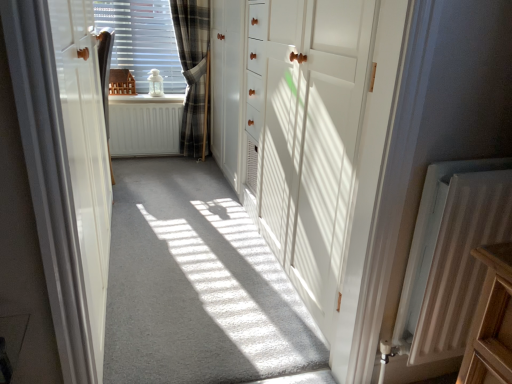
Question: Is white textured radiator at lower right, which appears as the first radiator when viewed from the front, completely or partially outside of plaid fabric curtain at center, which appears as the 1th curtain when viewed from the right?

Choices:
 (A) yes
 (B) no

Answer: (A)

Question: Is white textured radiator at lower right, the first radiator viewed from the right, beside plaid fabric curtain at center, which appears as the 2th curtain when viewed from the front?

Choices:
 (A) no
 (B) yes

Answer: (A)

Question: From a real-world perspective, is white textured radiator at lower right, placed as the second radiator when sorted from top to bottom, located higher than plaid fabric curtain at center, which is the 1th curtain in back-to-front order?

Choices:
 (A) yes
 (B) no

Answer: (B)

Question: Is white textured radiator at lower right, the 1th radiator positioned from the bottom, smaller than plaid fabric curtain at center, which appears as the 2th curtain when viewed from the front?

Choices:
 (A) no
 (B) yes

Answer: (B)

Question: Is white textured radiator at lower right, which is the 2th radiator in back-to-front order, positioned in front of plaid fabric curtain at center, which appears as the 2th curtain when viewed from the front?

Choices:
 (A) no
 (B) yes

Answer: (B)

Question: From a real-world perspective, is satin brown curtain at center, the second curtain in the back-to-front sequence, physically located above or below white carpet at center?

Choices:
 (A) above
 (B) below

Answer: (A)

Question: From the image's perspective, is satin brown curtain at center, positioned as the 1th curtain in left-to-right order, positioned above or below white carpet at center?

Choices:
 (A) above
 (B) below

Answer: (A)

Question: Considering the positions of satin brown curtain at center, acting as the 1th curtain starting from the front, and white carpet at center in the image, is satin brown curtain at center, acting as the 1th curtain starting from the front, bigger or smaller than white carpet at center?

Choices:
 (A) small
 (B) big

Answer: (A)

Question: Choose the correct answer: Is satin brown curtain at center, acting as the 1th curtain starting from the front, inside white carpet at center or outside it?

Choices:
 (A) outside
 (B) inside

Answer: (A)

Question: Considering the positions of point (56, 29) and point (440, 342), is point (56, 29) closer or farther from the camera than point (440, 342)?

Choices:
 (A) closer
 (B) farther

Answer: (B)

Question: Looking at their shapes, would you say white glossy door at left, the 1th door from the left, is wider or thinner than white textured radiator at lower right, which is the 2th radiator in back-to-front order?

Choices:
 (A) wide
 (B) thin

Answer: (A)

Question: From the image's perspective, relative to white textured radiator at lower right, the 2th radiator viewed from the left, is white glossy door at left, the 1th door from the left, above or below?

Choices:
 (A) below
 (B) above

Answer: (B)

Question: Is white glossy door at left, positioned as the second door in right-to-left order, situated inside white textured radiator at lower right, which appears as the first radiator when viewed from the front, or outside?

Choices:
 (A) inside
 (B) outside

Answer: (B)

Question: Is satin brown curtain at center, the second curtain when ordered from right to left, in front of or behind white wood door at center, the first door viewed from the right, in the image?

Choices:
 (A) front
 (B) behind

Answer: (B)

Question: From the image's perspective, relative to white wood door at center, the 2th door from the left, is satin brown curtain at center, the second curtain when ordered from right to left, above or below?

Choices:
 (A) below
 (B) above

Answer: (B)